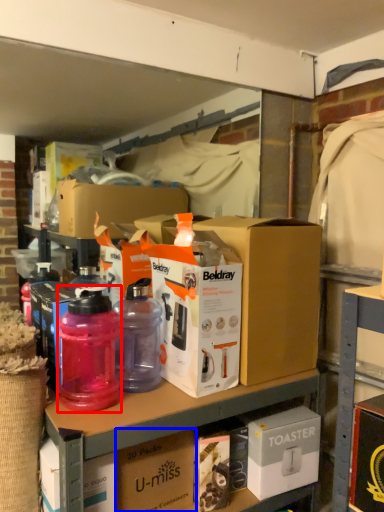
Question: Among these objects, which one is nearest to the camera, bottle (highlighted by a red box) or box (highlighted by a blue box)?

Choices:
 (A) bottle
 (B) box

Answer: (A)